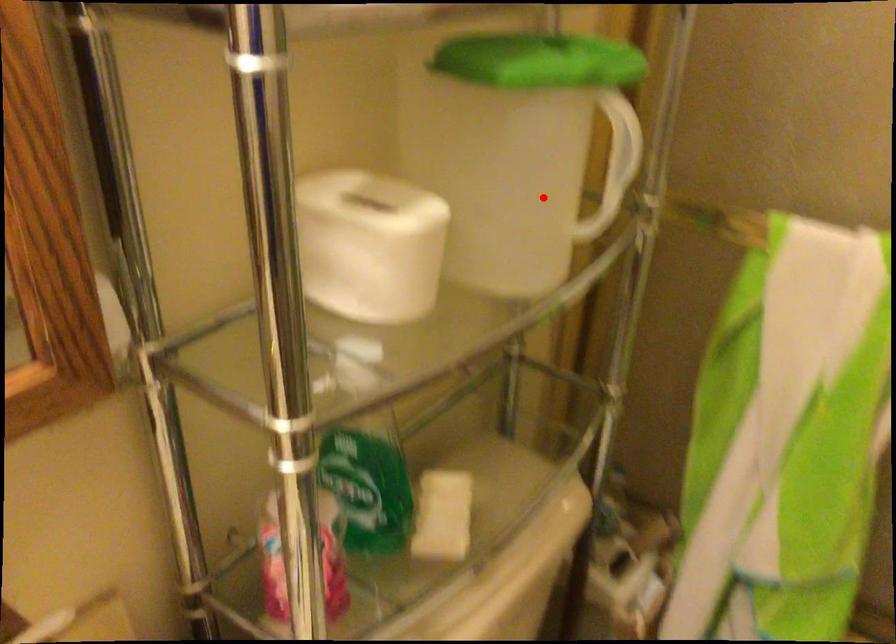
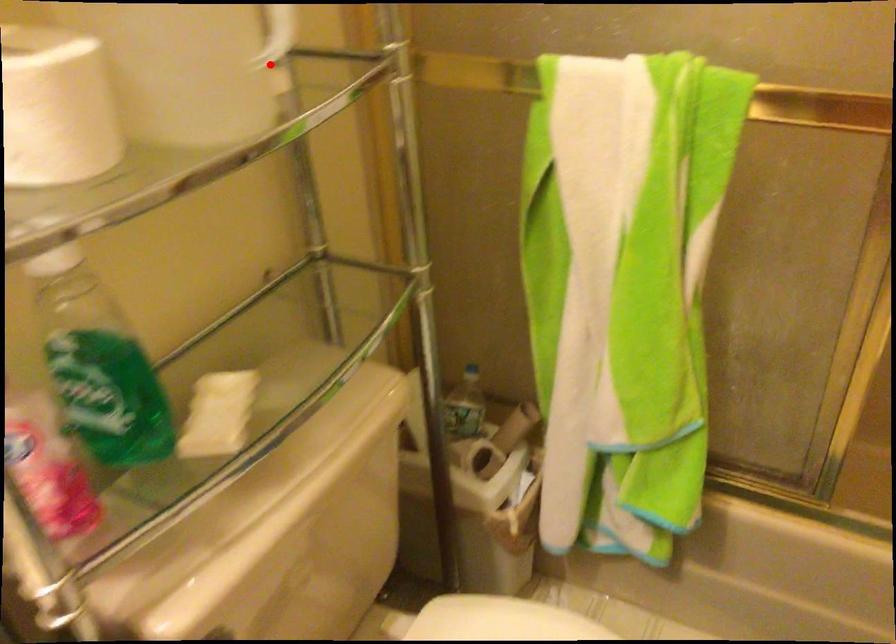
Looking at this image, I am providing you with two images of the same scene from different viewpoints. A red point is marked on the first image and another point is marked on the second image. Is the marked point in image1 the same physical position as the marked point in image2?

Yes